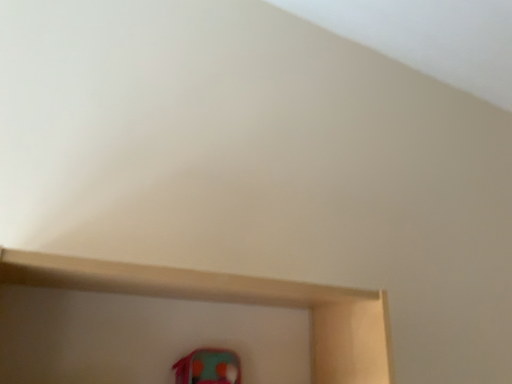
Question: Should I look upward or downward to see fuzzy felt shoe at lower center?

Choices:
 (A) up
 (B) down

Answer: (B)